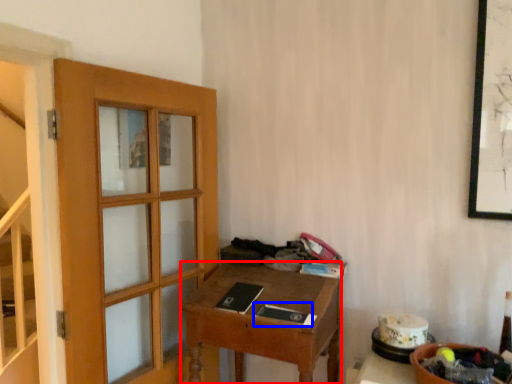
Question: Which point is closer to the camera, desk (highlighted by a red box) or book (highlighted by a blue box)?

Choices:
 (A) desk
 (B) book

Answer: (A)